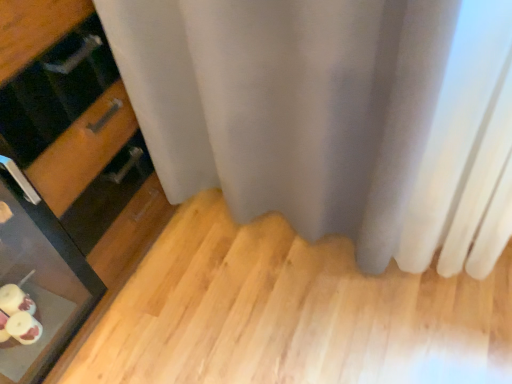
Describe the element at coordinates (78, 133) in the screenshot. I see `matte wood dresser at left` at that location.

Identify the location of matte wood dresser at left. (78, 133).

The height and width of the screenshot is (384, 512). In order to click on matte wood dresser at left in this screenshot , I will do `click(78, 133)`.